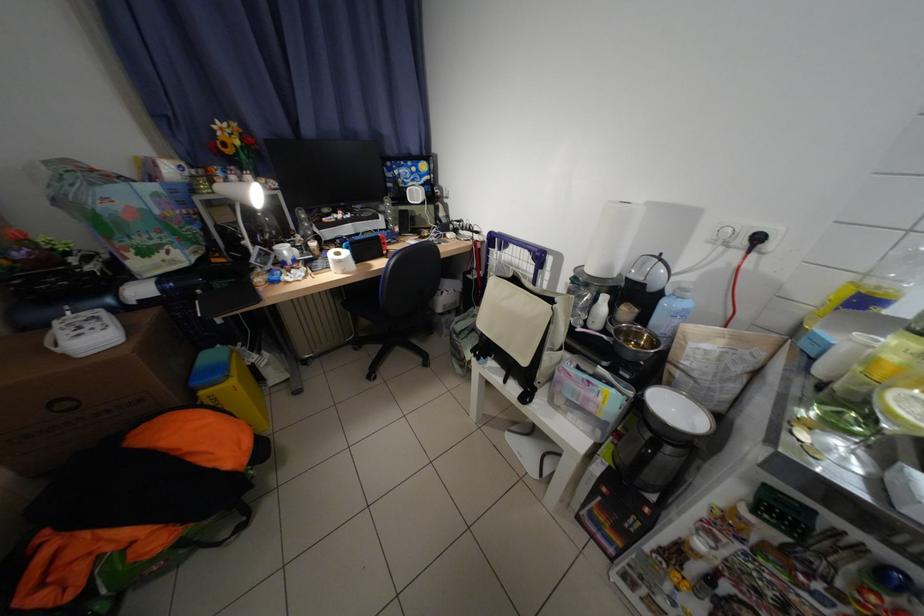
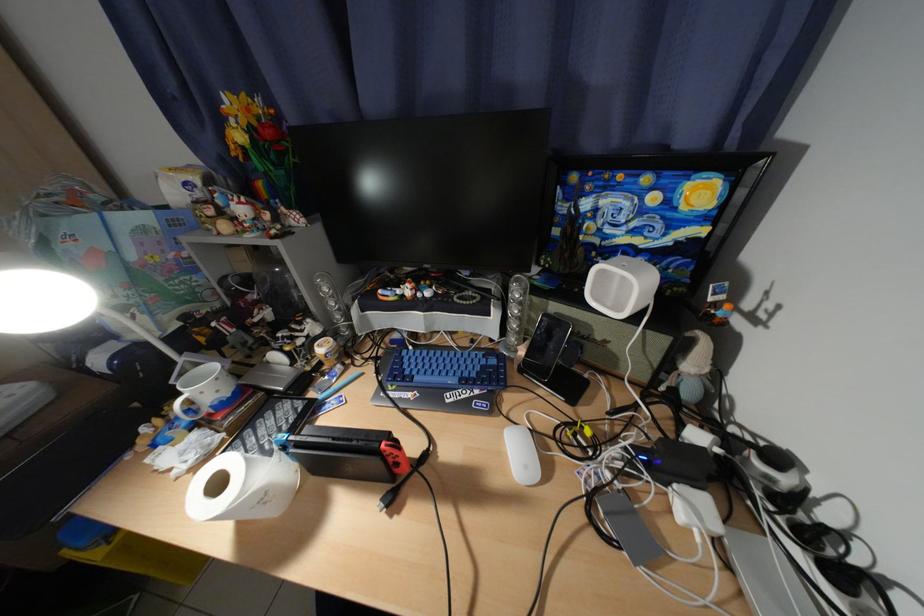
The point at (460, 236) is marked in the first image. Where is the corresponding point in the second image?

(700, 508)